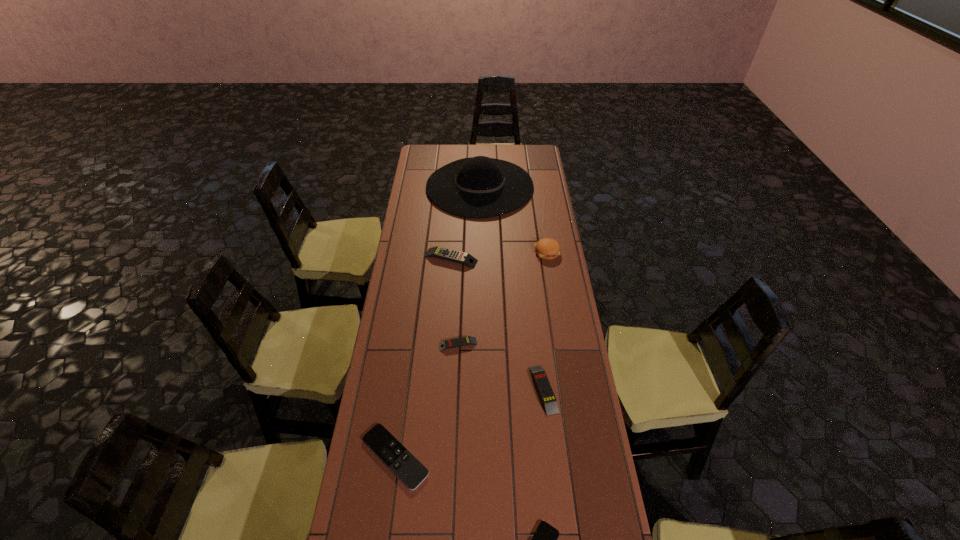
Locate an element on the screen. patty that is at the right edge is located at coordinates (546, 248).

At what (x,y) coordinates should I click in order to perform the action: click on remote control present at the right edge. Please return your answer as a coordinate pair (x, y). The image size is (960, 540). Looking at the image, I should click on (541, 380).

This screenshot has height=540, width=960. Find the location of `object that is positioned at the far left corner`. object that is positioned at the far left corner is located at coordinates (478, 187).

Find the location of a particular element. The height and width of the screenshot is (540, 960). object positioned at the far right corner is located at coordinates (478, 187).

Identify the location of blank area at the far edge. The image size is (960, 540). (463, 157).

Find the location of `free point at the left edge`. free point at the left edge is located at coordinates (434, 240).

What are the coordinates of `free space at the right edge` in the screenshot? It's located at (532, 258).

The height and width of the screenshot is (540, 960). Find the location of `vacant region at the far left corner of the desktop`. vacant region at the far left corner of the desktop is located at coordinates (419, 151).

Image resolution: width=960 pixels, height=540 pixels. I want to click on free space at the far right corner of the desktop, so click(519, 152).

At what (x,y) coordinates should I click in order to perform the action: click on free area in between the tallest object and the bigger black remote control. Please return your answer as a coordinate pair (x, y). The image size is (960, 540). Looking at the image, I should click on (438, 321).